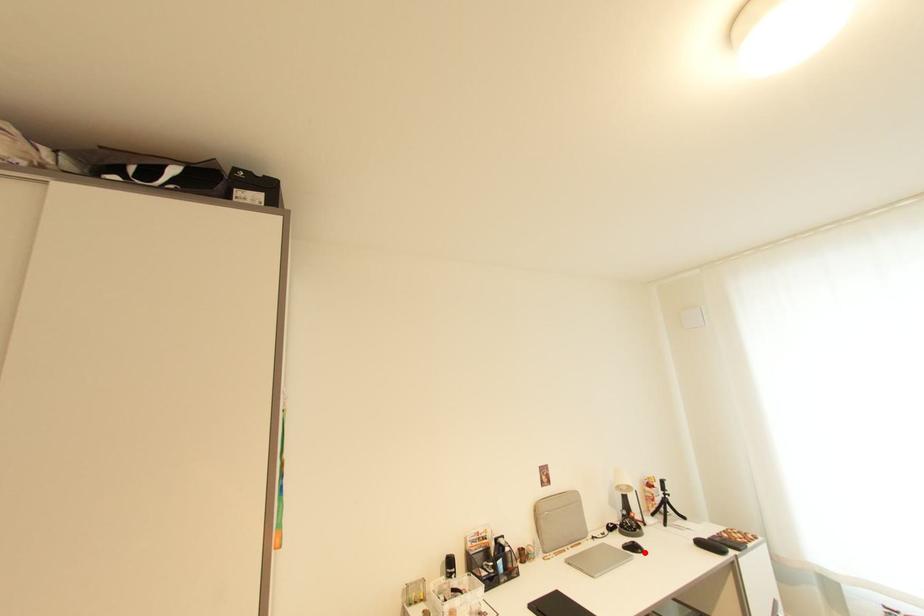
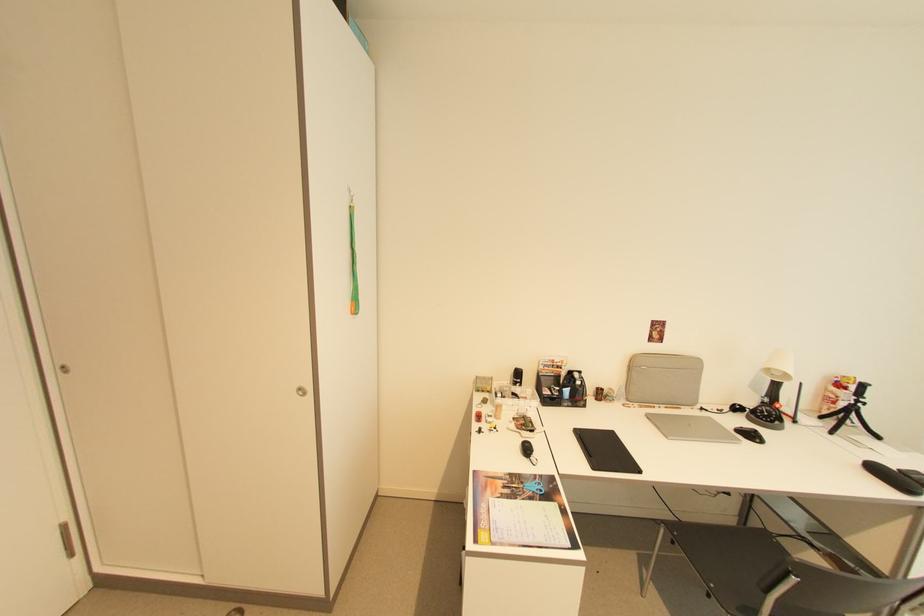
Where in the second image is the point corresponding to the highlighted location from the first image?

(762, 442)